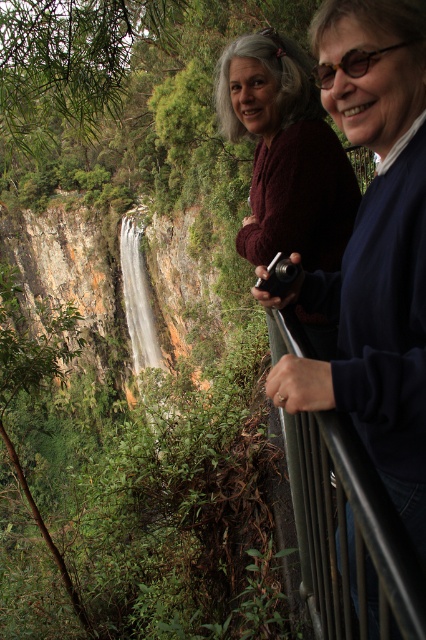
Which is more to the left, matte black camera at upper right or silver metallic camera at center?

silver metallic camera at center

Is matte black camera at upper right above silver metallic camera at center?

No, matte black camera at upper right is not above silver metallic camera at center.

Between point (409, 444) and point (259, 273), which one is positioned behind?

The point (259, 273) is more distant.

This screenshot has width=426, height=640. I want to click on matte black camera at upper right, so click(x=374, y=248).

Who is lower down, matte black camera at upper right or black metal/rail at right?

black metal/rail at right is below.

Is matte black camera at upper right above black metal/rail at right?

Indeed, matte black camera at upper right is positioned over black metal/rail at right.

Locate an element on the screen. matte black camera at upper right is located at coordinates (374, 248).

Does point (350, 220) lie behind point (261, 282)?

Yes, point (350, 220) is behind point (261, 282).

Is point (241, 72) positioned in front of point (287, 260)?

No.

The width and height of the screenshot is (426, 640). What do you see at coordinates (285, 154) in the screenshot? I see `maroon sweater at upper center` at bounding box center [285, 154].

At what (x,y) coordinates should I click in order to perform the action: click on maroon sweater at upper center. Please return your answer as a coordinate pair (x, y). The height and width of the screenshot is (640, 426). Looking at the image, I should click on (285, 154).